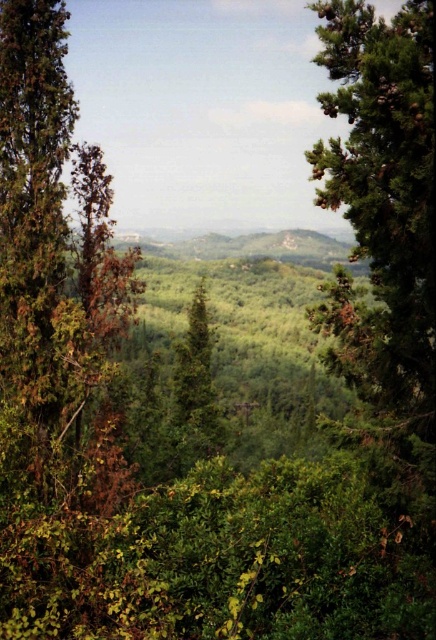
Question: Does green textured pine tree at right have a lesser width compared to green textured tree at center?

Choices:
 (A) no
 (B) yes

Answer: (B)

Question: Can you confirm if green textured pine tree at right is bigger than green textured tree at center?

Choices:
 (A) yes
 (B) no

Answer: (B)

Question: Is green textured pine tree at right bigger than green textured tree at center?

Choices:
 (A) yes
 (B) no

Answer: (B)

Question: Among these points, which one is farthest from the camera?

Choices:
 (A) (194, 454)
 (B) (405, 394)

Answer: (A)

Question: Among these points, which one is nearest to the camera?

Choices:
 (A) click(x=431, y=36)
 (B) click(x=204, y=388)

Answer: (A)